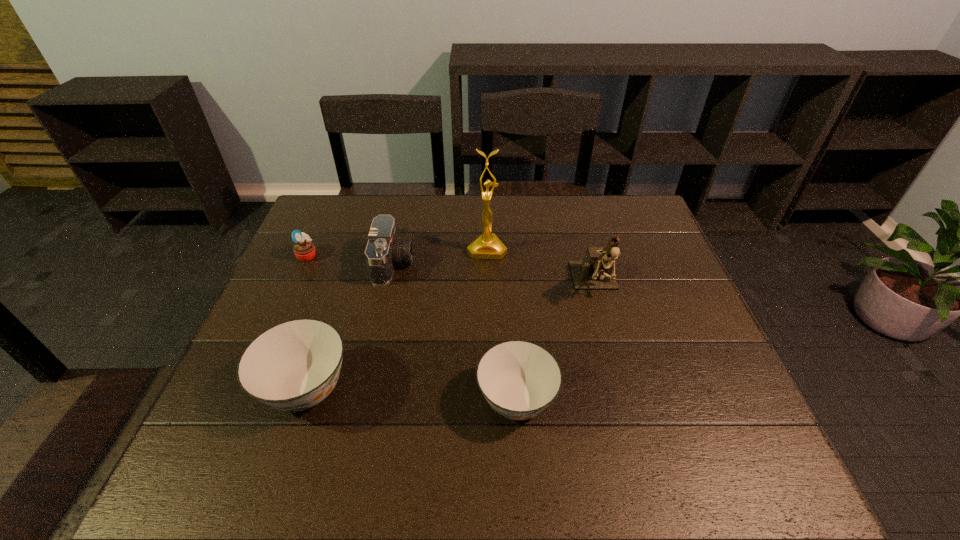
Image resolution: width=960 pixels, height=540 pixels. What are the coordinates of `vacant space at the far left corner of the desktop` in the screenshot? It's located at (345, 208).

Where is `vacant space at the far right corner`? This screenshot has width=960, height=540. vacant space at the far right corner is located at coordinates (607, 207).

Locate an element on the screen. The width and height of the screenshot is (960, 540). vacant region at the near right corner of the desktop is located at coordinates (704, 415).

The height and width of the screenshot is (540, 960). In order to click on unoccupied position between the shorter soup bowl and the taller soup bowl in this screenshot , I will do `click(411, 394)`.

I want to click on free space between the second tallest object and the tallest object, so click(x=541, y=267).

You are a GUI agent. You are given a task and a screenshot of the screen. Output one action in this format:
    pyautogui.click(x=<x>, y=<y>)
    Task: Click on the vacant space that's between the shorter soup bowl and the muffin
    
    Given the screenshot: What is the action you would take?
    pyautogui.click(x=412, y=327)

The height and width of the screenshot is (540, 960). Find the location of `free space between the camera and the right soup bowl`. free space between the camera and the right soup bowl is located at coordinates (455, 332).

Where is `free spot between the muffin and the right soup bowl`? The width and height of the screenshot is (960, 540). free spot between the muffin and the right soup bowl is located at coordinates (412, 327).

Where is `vacant space that is in between the muffin and the camera`? The width and height of the screenshot is (960, 540). vacant space that is in between the muffin and the camera is located at coordinates (350, 260).

Find the location of a particular element. The image size is (960, 540). empty space that is in between the camera and the rightmost object is located at coordinates (494, 274).